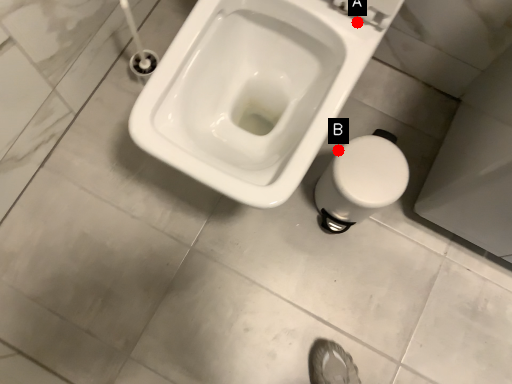
Question: Two points are circled on the image, labeled by A and B beside each circle. Among these points, which one is nearest to the camera?

Choices:
 (A) A is closer
 (B) B is closer

Answer: (A)